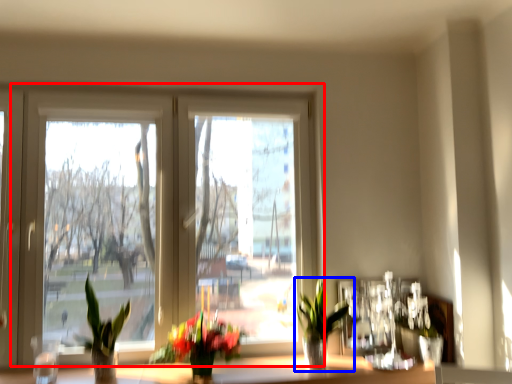
Question: Which point is further to the camera, window (highlighted by a red box) or houseplant (highlighted by a blue box)?

Choices:
 (A) window
 (B) houseplant

Answer: (A)